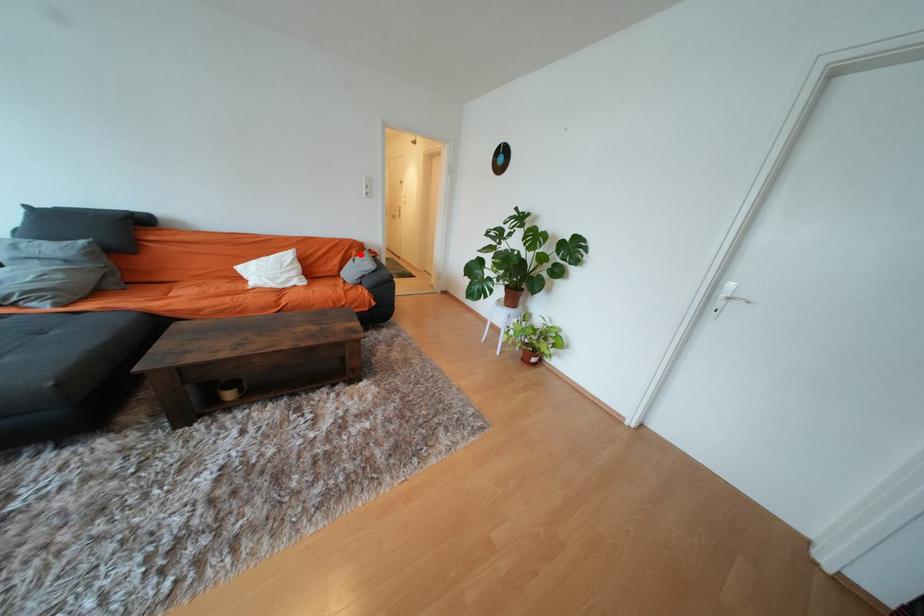
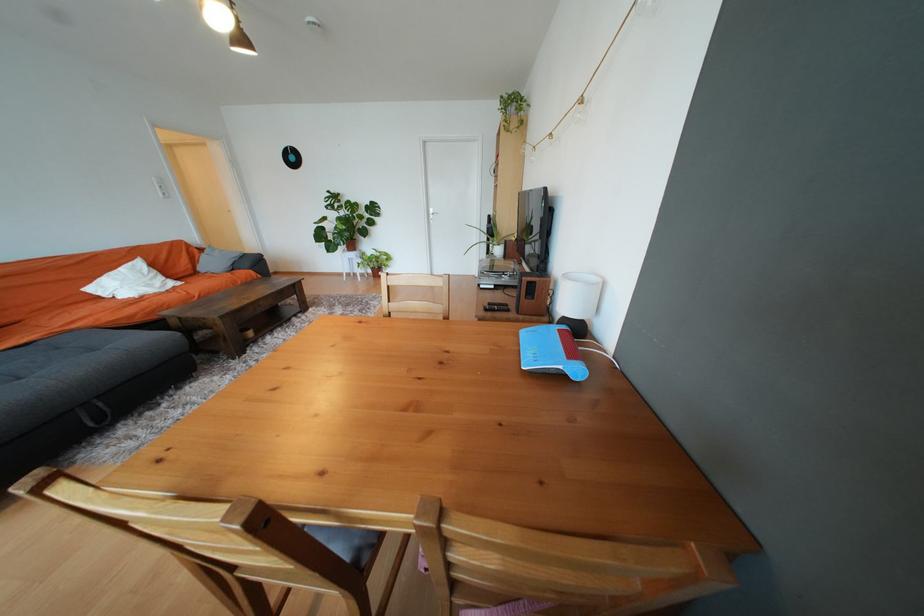
Find the pixel in the second image that matches the highlighted location in the first image.

(202, 252)